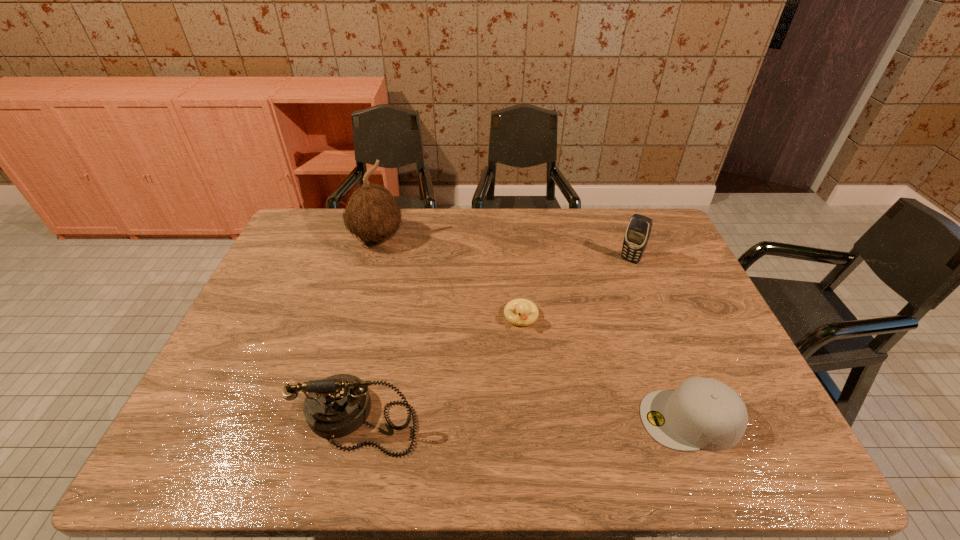
The image size is (960, 540). Find the location of `telephone present at the near edge`. telephone present at the near edge is located at coordinates (338, 405).

Locate an element on the screen. cap positioned at the near edge is located at coordinates (702, 413).

What are the coordinates of `cap located at the right edge` in the screenshot? It's located at (702, 413).

Where is `cellular telephone at the right edge`? Image resolution: width=960 pixels, height=540 pixels. cellular telephone at the right edge is located at coordinates (637, 234).

This screenshot has height=540, width=960. I want to click on object that is at the near right corner, so click(x=702, y=413).

In the image, there is a desktop. Identify the location of blank space at the far edge. The height and width of the screenshot is (540, 960). (540, 233).

You are a GUI agent. You are given a task and a screenshot of the screen. Output one action in this format:
    pyautogui.click(x=<x>, y=<y>)
    Task: Click on the vacant region at the left edge
    This screenshot has width=960, height=540.
    Given the screenshot: What is the action you would take?
    pyautogui.click(x=257, y=341)

You are a GUI agent. You are given a task and a screenshot of the screen. Output one action in this format:
    pyautogui.click(x=<x>, y=<y>)
    Task: Click on the vacant space at the right edge of the desktop
    Image resolution: width=960 pixels, height=540 pixels.
    Given the screenshot: What is the action you would take?
    pyautogui.click(x=706, y=334)

Locate an element on the screen. The width and height of the screenshot is (960, 540). vacant area at the far left corner of the desktop is located at coordinates (282, 243).

Where is `vacant space at the near left corner of the desktop`? The image size is (960, 540). vacant space at the near left corner of the desktop is located at coordinates (215, 396).